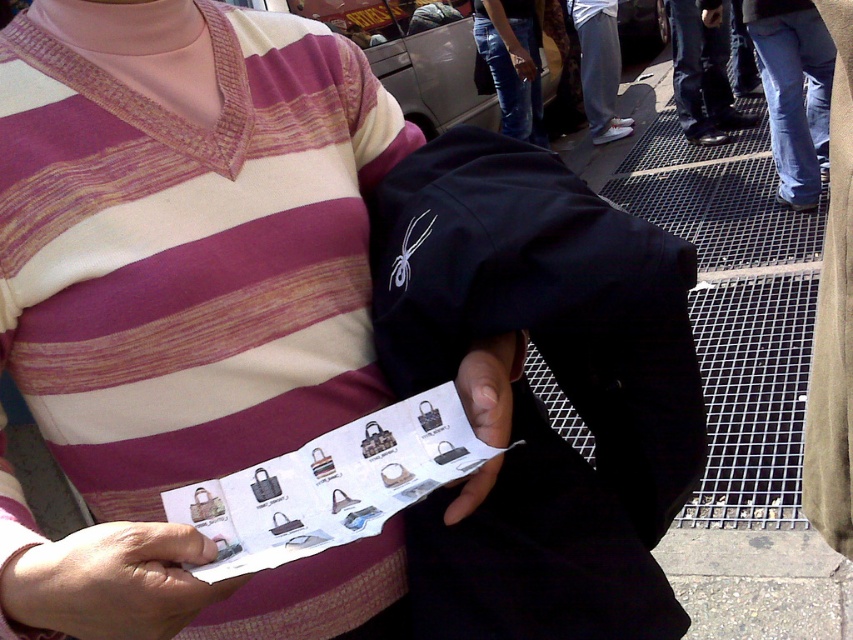
Question: Which object is farther from the camera taking this photo?

Choices:
 (A) matte black bag at lower center
 (B) light blue jeans at lower right

Answer: (B)

Question: Where is white paper at center located in relation to matte black bag at lower center in the image?

Choices:
 (A) right
 (B) left

Answer: (B)

Question: Can you confirm if black leather shoes at lower right is wider than light blue jeans at lower right?

Choices:
 (A) yes
 (B) no

Answer: (A)

Question: Which object is the closest to the light blue jeans at lower right?

Choices:
 (A) white paper at center
 (B) matte black bag at center
 (C) matte black bag at lower center

Answer: (B)

Question: Can you confirm if jeans at lower right is thinner than jeans at center?

Choices:
 (A) yes
 (B) no

Answer: (A)

Question: Among these objects, which one is nearest to the camera?

Choices:
 (A) jeans at lower right
 (B) black leather shoes at lower right

Answer: (A)